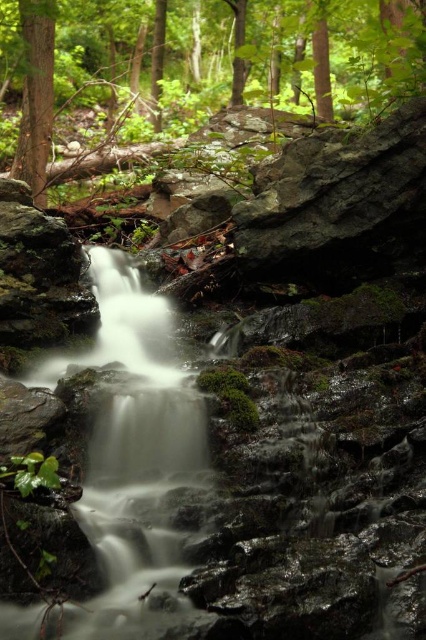
Question: In this image, where is green matte tree trunk at center located relative to smooth brown tree trunk at upper left?

Choices:
 (A) below
 (B) above

Answer: (B)

Question: Which object appears closest to the camera in this image?

Choices:
 (A) green matte tree trunk at center
 (B) smooth brown tree trunk at upper left

Answer: (A)

Question: Does green matte tree trunk at center come in front of smooth brown tree trunk at upper left?

Choices:
 (A) yes
 (B) no

Answer: (A)

Question: Which object appears closest to the camera in this image?

Choices:
 (A) smooth brown tree trunk at upper left
 (B) green matte tree trunk at center

Answer: (B)

Question: Is green matte tree trunk at center positioned behind smooth brown tree trunk at upper left?

Choices:
 (A) no
 (B) yes

Answer: (A)